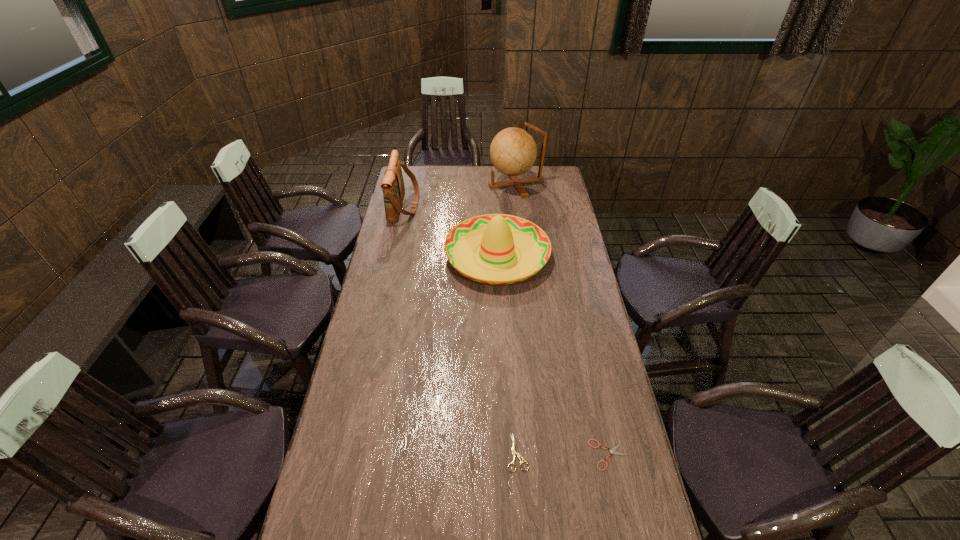
Locate an element on the screen. the tallest object is located at coordinates (513, 151).

Image resolution: width=960 pixels, height=540 pixels. In order to click on shoulder bag in this screenshot , I will do `click(392, 184)`.

This screenshot has height=540, width=960. Find the location of `sombrero`. sombrero is located at coordinates (501, 237).

Locate an element on the screen. The width and height of the screenshot is (960, 540). the taller shears is located at coordinates (514, 452).

Locate an element on the screen. The image size is (960, 540). the second shortest object is located at coordinates 514,452.

Identify the location of the right shears. The width and height of the screenshot is (960, 540). (612, 451).

Identify the location of the shortest object. (612, 451).

This screenshot has width=960, height=540. I want to click on vacant space located on the surface of the globe, so click(x=475, y=184).

Image resolution: width=960 pixels, height=540 pixels. What are the coordinates of `free space located on the surface of the globe` in the screenshot? It's located at (465, 184).

Find the location of a particular element. This screenshot has width=960, height=540. free space located on the surface of the globe is located at coordinates (428, 184).